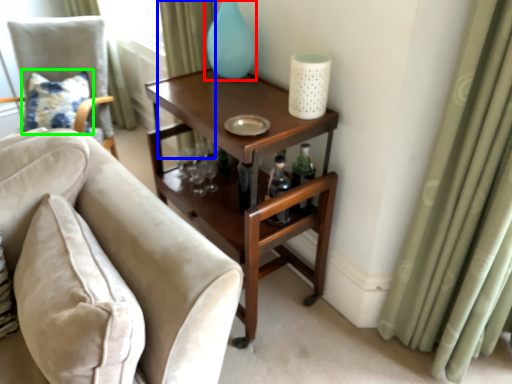
Question: Which object is the farthest from glass vase (highlighted by a red box)? Choose among these: curtain (highlighted by a blue box) or pillow (highlighted by a green box).

Choices:
 (A) curtain
 (B) pillow

Answer: (B)